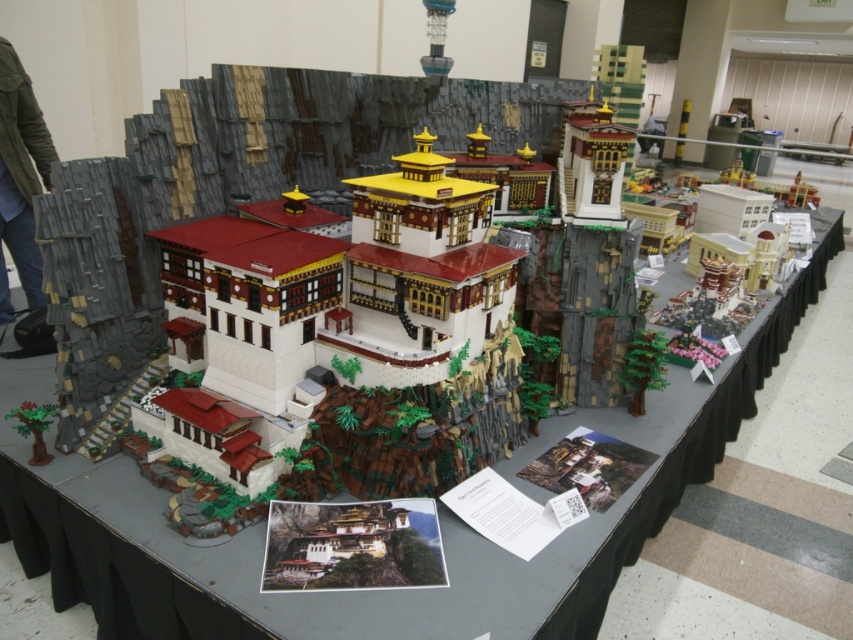
Is white lego structure at center below matte gray bricks at left?

Yes.

Is white lego structure at center to the right of matte gray bricks at left from the viewer's perspective?

Correct, you'll find white lego structure at center to the right of matte gray bricks at left.

I want to click on white lego structure at center, so click(614, 504).